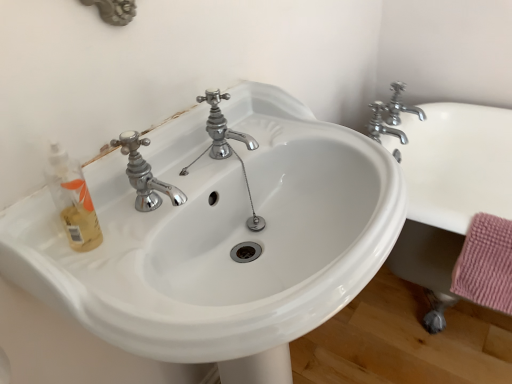
Locate an element on the screen. vacant space behind chrome metallic faucet at upper right, acting as the first tap starting from the right is located at coordinates (403, 113).